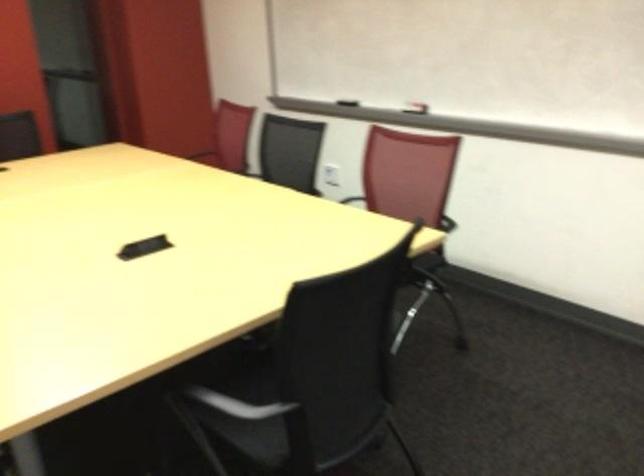
Image resolution: width=644 pixels, height=476 pixels. What do you see at coordinates (392, 267) in the screenshot? I see `the black chair sitting surface` at bounding box center [392, 267].